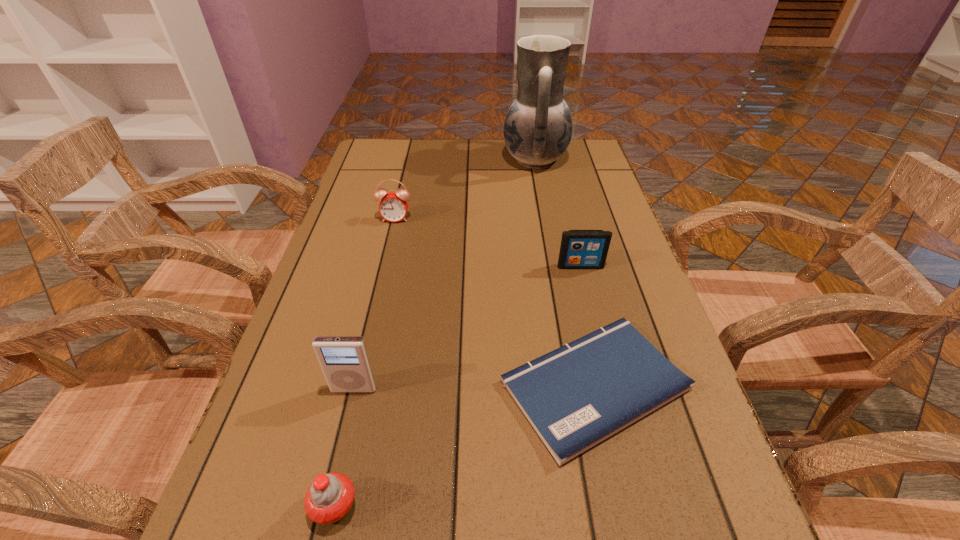
You are a GUI agent. You are given a task and a screenshot of the screen. Output one action in this format:
    pyautogui.click(x=<x>, y=<y>)
    Task: Click on the farthest object
    The width and height of the screenshot is (960, 540).
    Given the screenshot: What is the action you would take?
    pyautogui.click(x=538, y=126)

I want to click on the tallest object, so click(538, 126).

The height and width of the screenshot is (540, 960). I want to click on the nearer iPod, so click(x=344, y=360).

Locate an element on the screen. This screenshot has height=540, width=960. the left iPod is located at coordinates (344, 360).

This screenshot has height=540, width=960. I want to click on the second farthest object, so click(x=393, y=206).

In order to click on the shorter iPod in this screenshot , I will do `click(580, 249)`.

Locate an element on the screen. the fourth nearest object is located at coordinates (580, 249).

What are the coordinates of `the nearest object` in the screenshot? It's located at (328, 500).

In order to click on the shortest object in this screenshot , I will do `click(576, 396)`.

At what (x,y) coordinates should I click in order to perform the action: click on free location located on the front-facing side of the farthest object. Please return your answer as a coordinate pair (x, y). This screenshot has width=960, height=540. Looking at the image, I should click on (474, 160).